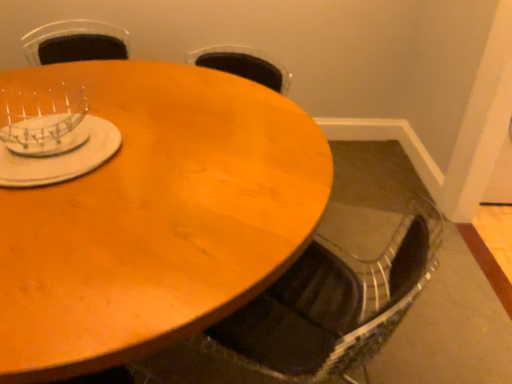
This screenshot has height=384, width=512. Describe the element at coordinates (332, 305) in the screenshot. I see `metallic silver swivel chair at lower center` at that location.

You are a GUI agent. You are given a task and a screenshot of the screen. Output one action in this format:
    pyautogui.click(x=<x>, y=<y>)
    Task: Click on the metallic silver swivel chair at lower center
    
    Given the screenshot: What is the action you would take?
    332,305

Image resolution: width=512 pixels, height=384 pixels. What do you see at coordinates (155, 218) in the screenshot?
I see `wooden table at center` at bounding box center [155, 218].

Describe the element at coordinates (62, 158) in the screenshot. This screenshot has width=512, height=384. I see `white matte plate at upper left, which is the 2th tableware from top to bottom` at that location.

You are a GUI agent. You are given a task and a screenshot of the screen. Output one action in this format:
    pyautogui.click(x=<x>, y=<y>)
    Task: Click on the metallic silver swivel chair at lower center
    The height and width of the screenshot is (384, 512).
    Given the screenshot: What is the action you would take?
    pyautogui.click(x=332, y=305)

Looking at this image, between metallic silver swivel chair at lower center and wooden table at center, which one has smaller size?

metallic silver swivel chair at lower center is smaller.

From the image's perspective, is metallic silver swivel chair at lower center located beneath wooden table at center?

Yes, from the image's perspective, metallic silver swivel chair at lower center is below wooden table at center.

Is point (386, 246) closer or farther from the camera than point (99, 202)?

Clearly, point (386, 246) is more distant from the camera than point (99, 202).

Which object is positioned more to the right, metallic silver swivel chair at lower center or wooden table at center?

metallic silver swivel chair at lower center is more to the right.

Is metallic silver swivel chair at lower center beside white matte plate at upper left, which is the 2th tableware from top to bottom?

metallic silver swivel chair at lower center is not next to white matte plate at upper left, which is the 2th tableware from top to bottom, and they're not touching.

Is metallic silver swivel chair at lower center facing away from white matte plate at upper left, which is the 2th tableware from top to bottom?

No, metallic silver swivel chair at lower center is not facing the opposite direction of white matte plate at upper left, which is the 2th tableware from top to bottom.

Is clear plastic dish rack at upper left, which is the first tableware in top-to-bottom order, to the left or to the right of metallic silver swivel chair at lower center in the image?

Based on their positions, clear plastic dish rack at upper left, which is the first tableware in top-to-bottom order, is located to the left of metallic silver swivel chair at lower center.

Is clear plastic dish rack at upper left, placed as the 2th tableware when sorted from bottom to top, looking in the opposite direction of metallic silver swivel chair at lower center?

clear plastic dish rack at upper left, placed as the 2th tableware when sorted from bottom to top, is not turned away from metallic silver swivel chair at lower center.

Does point (83, 126) appear closer or farther from the camera than point (243, 357)?

Clearly, point (83, 126) is closer to the camera than point (243, 357).

From the image's perspective, is wooden table at center over clear plastic dish rack at upper left, which is the first tableware in top-to-bottom order?

Incorrect, from the image's perspective, wooden table at center is lower than clear plastic dish rack at upper left, which is the first tableware in top-to-bottom order.

Is wooden table at center turned away from clear plastic dish rack at upper left, placed as the 2th tableware when sorted from bottom to top?

That's not correct — wooden table at center is not looking away from clear plastic dish rack at upper left, placed as the 2th tableware when sorted from bottom to top.

Which object is positioned more to the right, wooden table at center or clear plastic dish rack at upper left, placed as the 2th tableware when sorted from bottom to top?

Positioned to the right is wooden table at center.

Are white matte plate at upper left, which is counted as the first tableware, starting from the bottom, and wooden table at center making contact?

No, white matte plate at upper left, which is counted as the first tableware, starting from the bottom, is not beside wooden table at center.

From the image's perspective, which one is positioned lower, white matte plate at upper left, which is counted as the first tableware, starting from the bottom, or wooden table at center?

wooden table at center.

Is white matte plate at upper left, which is counted as the first tableware, starting from the bottom, positioned before wooden table at center?

No, white matte plate at upper left, which is counted as the first tableware, starting from the bottom, is further to the viewer.

Between white matte plate at upper left, which is the 2th tableware from top to bottom, and wooden table at center, which one appears on the left side from the viewer's perspective?

white matte plate at upper left, which is the 2th tableware from top to bottom.

How different are the orientations of metallic silver swivel chair at lower center and clear plastic dish rack at upper left, which is the first tableware in top-to-bottom order, in degrees?

The angle between the facing direction of metallic silver swivel chair at lower center and the facing direction of clear plastic dish rack at upper left, which is the first tableware in top-to-bottom order, is 27.8 degrees.

Is point (278, 280) positioned in front of point (63, 127)?

Yes, it is.

From the image's perspective, is metallic silver swivel chair at lower center on clear plastic dish rack at upper left, placed as the 2th tableware when sorted from bottom to top?

No, from the image's perspective, metallic silver swivel chair at lower center is not above clear plastic dish rack at upper left, placed as the 2th tableware when sorted from bottom to top.

Is clear plastic dish rack at upper left, which is the first tableware in top-to-bottom order, not within wooden table at center?

Indeed, clear plastic dish rack at upper left, which is the first tableware in top-to-bottom order, is completely outside wooden table at center.

Identify the location of the 2nd tableware to the left when counting from the wooden table at center. This screenshot has width=512, height=384. (x=42, y=119).

Is clear plastic dish rack at upper left, placed as the 2th tableware when sorted from bottom to top, bigger or smaller than wooden table at center?

In the image, clear plastic dish rack at upper left, placed as the 2th tableware when sorted from bottom to top, appears to be smaller than wooden table at center.

Which point is more forward, (x=63, y=97) or (x=72, y=75)?

The point (x=63, y=97) is in front.

The width and height of the screenshot is (512, 384). What are the coordinates of `swivel chair that is above the wooden table at center (from a real-world perspective)` in the screenshot? It's located at (332, 305).

The image size is (512, 384). What are the coordinates of `swivel chair that is below the white matte plate at upper left, which is counted as the first tableware, starting from the bottom (from the image's perspective)` in the screenshot? It's located at (332, 305).

When comparing their distances from white matte plate at upper left, which is the 2th tableware from top to bottom, does metallic silver swivel chair at lower center or wooden table at center seem further?

Among the two, metallic silver swivel chair at lower center is located further to white matte plate at upper left, which is the 2th tableware from top to bottom.

Estimate the real-world distances between objects in this image. Which object is closer to wooden table at center, clear plastic dish rack at upper left, which is the first tableware in top-to-bottom order, or metallic silver swivel chair at lower center?

clear plastic dish rack at upper left, which is the first tableware in top-to-bottom order.

From the image, which object appears to be nearer to wooden table at center, white matte plate at upper left, which is the 2th tableware from top to bottom, or clear plastic dish rack at upper left, which is the first tableware in top-to-bottom order?

Among the two, white matte plate at upper left, which is the 2th tableware from top to bottom, is located nearer to wooden table at center.

When comparing their distances from white matte plate at upper left, which is counted as the first tableware, starting from the bottom, does metallic silver swivel chair at lower center or clear plastic dish rack at upper left, which is the first tableware in top-to-bottom order, seem closer?

The object closer to white matte plate at upper left, which is counted as the first tableware, starting from the bottom, is clear plastic dish rack at upper left, which is the first tableware in top-to-bottom order.

Based on their spatial positions, is clear plastic dish rack at upper left, which is the first tableware in top-to-bottom order, or white matte plate at upper left, which is counted as the first tableware, starting from the bottom, closer to wooden table at center?

Based on the image, white matte plate at upper left, which is counted as the first tableware, starting from the bottom, appears to be nearer to wooden table at center.

From the image, which object appears to be nearer to wooden table at center, metallic silver swivel chair at lower center or white matte plate at upper left, which is counted as the first tableware, starting from the bottom?

white matte plate at upper left, which is counted as the first tableware, starting from the bottom, is positioned closer to the anchor wooden table at center.

When comparing their distances from metallic silver swivel chair at lower center, does white matte plate at upper left, which is counted as the first tableware, starting from the bottom, or clear plastic dish rack at upper left, which is the first tableware in top-to-bottom order, seem closer?

white matte plate at upper left, which is counted as the first tableware, starting from the bottom.

Based on their spatial positions, is wooden table at center or metallic silver swivel chair at lower center closer to white matte plate at upper left, which is counted as the first tableware, starting from the bottom?

wooden table at center.

I want to click on tableware between clear plastic dish rack at upper left, placed as the 2th tableware when sorted from bottom to top, and metallic silver swivel chair at lower center, in the horizontal direction, so click(62, 158).

The height and width of the screenshot is (384, 512). Find the location of `tableware located between wooden table at center and clear plastic dish rack at upper left, which is the first tableware in top-to-bottom order, in the depth direction`. tableware located between wooden table at center and clear plastic dish rack at upper left, which is the first tableware in top-to-bottom order, in the depth direction is located at coordinates (62, 158).

You are a GUI agent. You are given a task and a screenshot of the screen. Output one action in this format:
    pyautogui.click(x=<x>, y=<y>)
    Task: Click on the coffee table between clear plastic dish rack at upper left, placed as the 2th tableware when sorted from bottom to top, and metallic silver swivel chair at lower center
    
    Given the screenshot: What is the action you would take?
    tap(155, 218)

This screenshot has height=384, width=512. What are the coordinates of `coffee table situated between white matte plate at upper left, which is counted as the first tableware, starting from the bottom, and metallic silver swivel chair at lower center from left to right` in the screenshot? It's located at (155, 218).